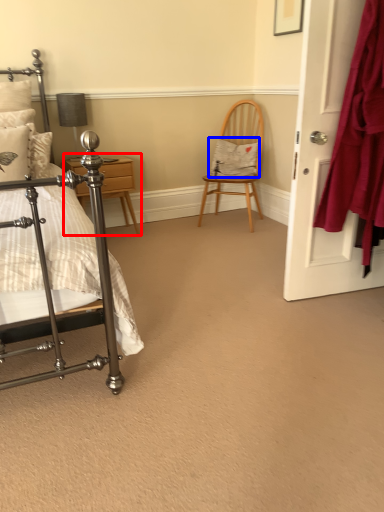
Question: Which of the following is the closest to the observer, nightstand (highlighted by a red box) or pillow (highlighted by a blue box)?

Choices:
 (A) nightstand
 (B) pillow

Answer: (A)